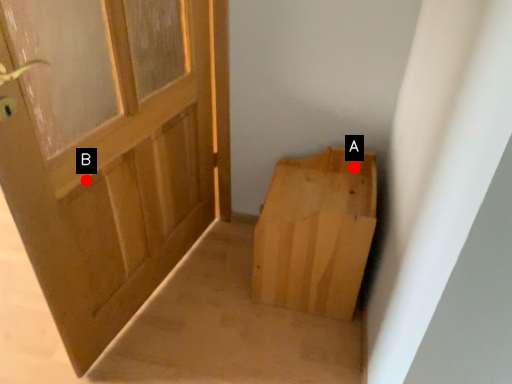
Question: Two points are circled on the image, labeled by A and B beside each circle. Among these points, which one is nearest to the camera?

Choices:
 (A) A is closer
 (B) B is closer

Answer: (B)